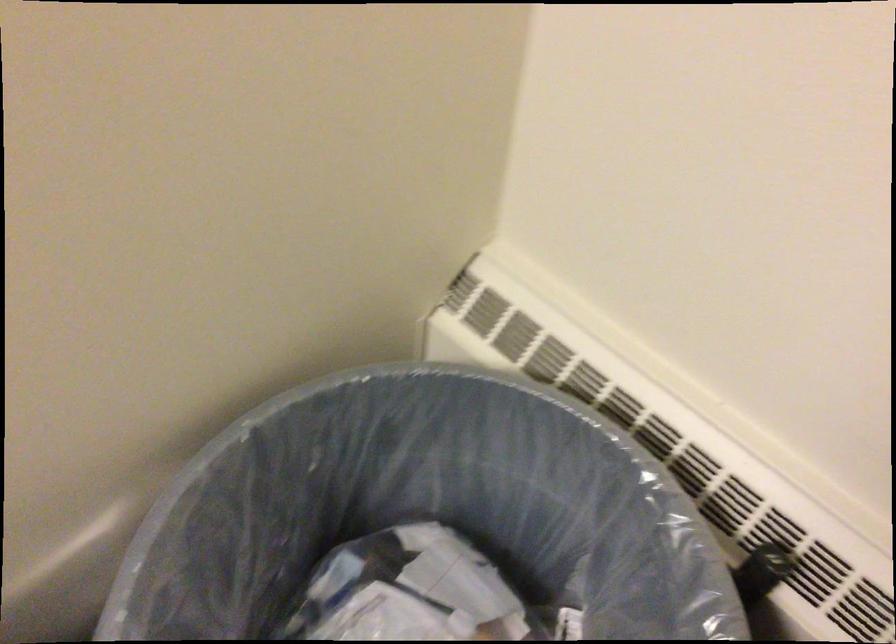
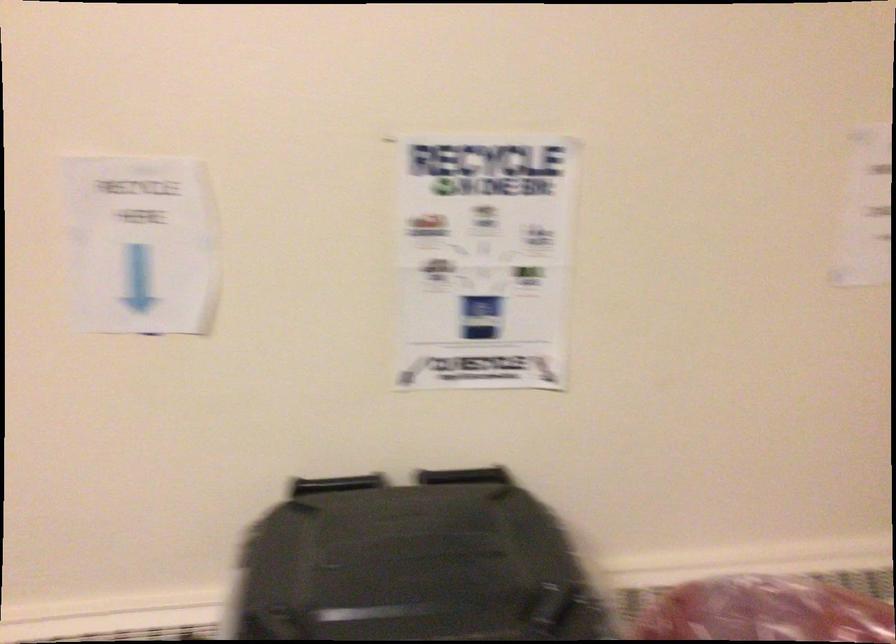
Question: The camera is either moving clockwise (left) or counter-clockwise (right) around the object. The first image is from the beginning of the video and the second image is from the end. Is the camera moving left or right when shooting the video?

Choices:
 (A) Left
 (B) Right

Answer: (A)